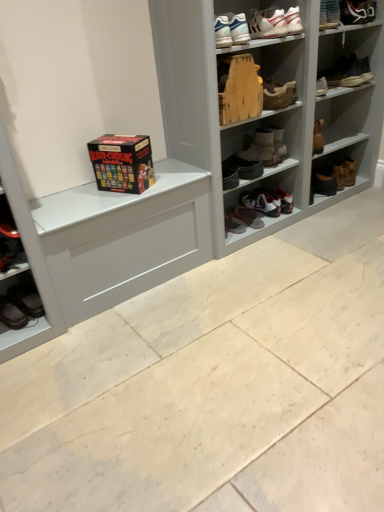
Question: Can you confirm if wooden shoe at upper center, positioned as the 8th footwear in left-to-right order, is positioned to the left of matte white cabinet at lower left?

Choices:
 (A) yes
 (B) no

Answer: (B)

Question: Can you confirm if wooden shoe at upper center, positioned as the 8th footwear in left-to-right order, is taller than matte white cabinet at lower left?

Choices:
 (A) yes
 (B) no

Answer: (B)

Question: Considering the relative sizes of wooden shoe at upper center, positioned as the 8th footwear in left-to-right order, and matte white cabinet at lower left in the image provided, is wooden shoe at upper center, positioned as the 8th footwear in left-to-right order, smaller than matte white cabinet at lower left?

Choices:
 (A) yes
 (B) no

Answer: (A)

Question: Is the surface of wooden shoe at upper center, acting as the 6th footwear starting from the right, in direct contact with matte white cabinet at lower left?

Choices:
 (A) yes
 (B) no

Answer: (B)

Question: Is the depth of wooden shoe at upper center, positioned as the 8th footwear in left-to-right order, greater than that of matte white cabinet at lower left?

Choices:
 (A) no
 (B) yes

Answer: (B)

Question: From the image's perspective, would you say wooden shoe at upper center, acting as the 6th footwear starting from the right, is positioned over matte white cabinet at lower left?

Choices:
 (A) yes
 (B) no

Answer: (A)

Question: Is brown leather boot at upper right, which ranks as the 1th footwear in right-to-left order, bigger than white leather sneakers at upper center, placed as the 7th footwear when sorted from right to left?

Choices:
 (A) yes
 (B) no

Answer: (A)

Question: Could you tell me if brown leather boot at upper right, which ranks as the 1th footwear in right-to-left order, is turned towards white leather sneakers at upper center, which is the seventh footwear in left-to-right order?

Choices:
 (A) yes
 (B) no

Answer: (B)

Question: From a real-world perspective, is brown leather boot at upper right, which ranks as the 1th footwear in right-to-left order, on top of white leather sneakers at upper center, which is the seventh footwear in left-to-right order?

Choices:
 (A) no
 (B) yes

Answer: (A)

Question: Is brown leather boot at upper right, which is the thirteenth footwear in left-to-right order, at the left side of white leather sneakers at upper center, placed as the 7th footwear when sorted from right to left?

Choices:
 (A) yes
 (B) no

Answer: (B)

Question: Can you confirm if brown leather boot at upper right, which ranks as the 1th footwear in right-to-left order, is smaller than white leather sneakers at upper center, which is the seventh footwear in left-to-right order?

Choices:
 (A) no
 (B) yes

Answer: (A)

Question: From the image's perspective, does brown leather boot at upper right, which ranks as the 1th footwear in right-to-left order, appear lower than white leather sneakers at upper center, which is the seventh footwear in left-to-right order?

Choices:
 (A) no
 (B) yes

Answer: (B)

Question: Is white leather sneaker at upper right, acting as the 11th footwear starting from the left, located outside wooden shoe at upper center, acting as the 6th footwear starting from the right?

Choices:
 (A) no
 (B) yes

Answer: (B)